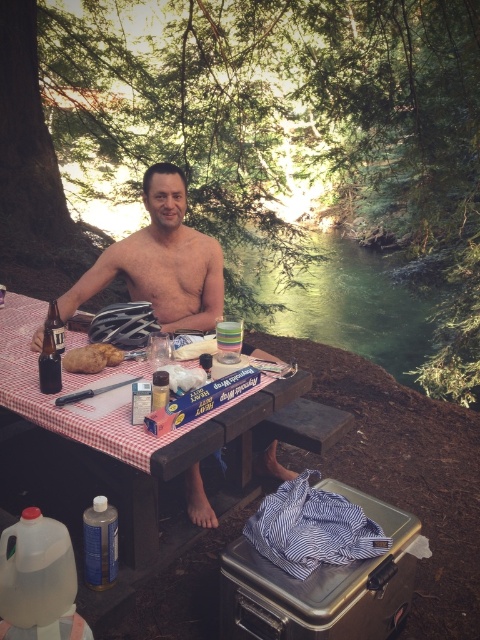
At what (x,y) coordinates should I click in order to perform the action: click on wooden picnic table at center. Please return your answer as a coordinate pair (x, y). The height and width of the screenshot is (640, 480). Looking at the image, I should click on (128, 429).

Between wooden picnic table at center and brown crumbly bread at table front, which one is positioned higher?

wooden picnic table at center is above.

Between point (273, 406) and point (84, 348), which one is positioned behind?

The point (84, 348) is behind.

Find the location of a particular element. wooden picnic table at center is located at coordinates (128, 429).